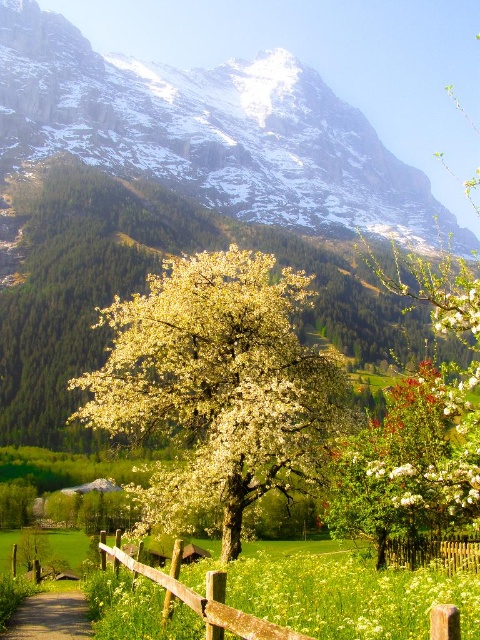
You are standing at the edge of the brown dirt path at lower left and want to walk towards the brown wooden fence at lower center. In which direction should you move?

The brown wooden fence at lower center is to the right of the brown dirt path at lower left, so you should move to the right to reach it.

You are standing in front of the scene and want to know which object is wider between the white blossoming tree at center and the brown wooden fence at lower center. Can you determine this based on their sizes?

The white blossoming tree at center is wider than the brown wooden fence at lower center according to their sizes.